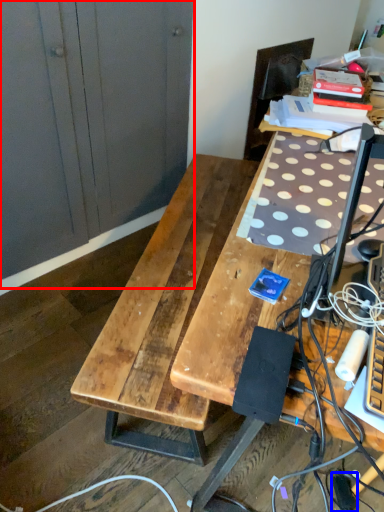
Question: Which object is closer to the camera taking this photo, dresser (highlighted by a red box) or extension cord (highlighted by a blue box)?

Choices:
 (A) dresser
 (B) extension cord

Answer: (A)